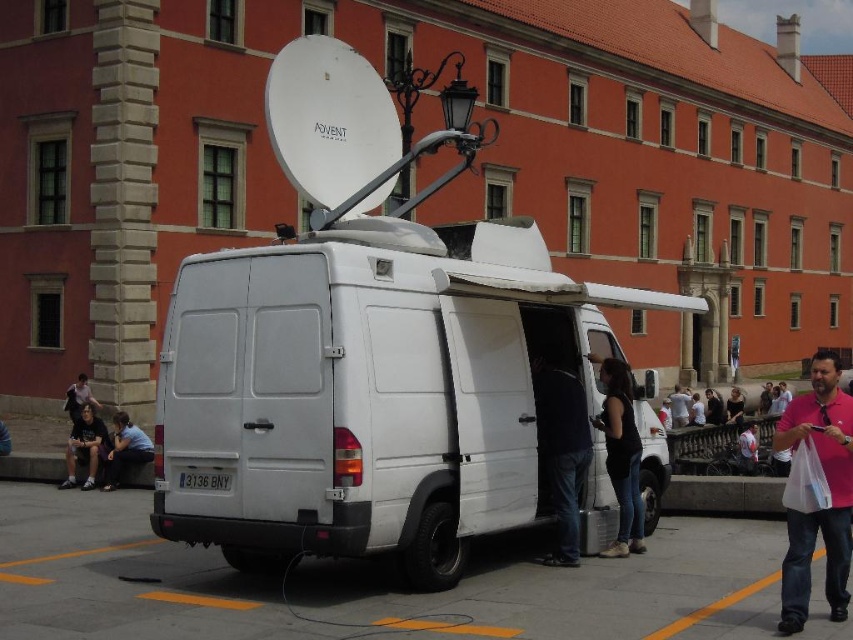
Question: Does black matte tank top at center appear over dark hair at lower center?

Choices:
 (A) yes
 (B) no

Answer: (A)

Question: In this image, where is black matte tank top at center located relative to dark blue jeans at lower left?

Choices:
 (A) left
 (B) right

Answer: (B)

Question: Does white matte van at center have a larger size compared to dark hair at lower center?

Choices:
 (A) yes
 (B) no

Answer: (A)

Question: Which of the following is the farthest from the observer?

Choices:
 (A) smooth white shirt at center
 (B) white matte van at center
 (C) matte black jacket at upper left

Answer: (A)

Question: Among these objects, which one is nearest to the camera?

Choices:
 (A) matte black jacket at upper left
 (B) black fabric pants at lower center
 (C) dark hair at lower center

Answer: (B)

Question: Among these points, which one is farthest from the camera?

Choices:
 (A) (80, 376)
 (B) (451, 481)
 (C) (740, 449)
 (D) (85, 417)

Answer: (A)